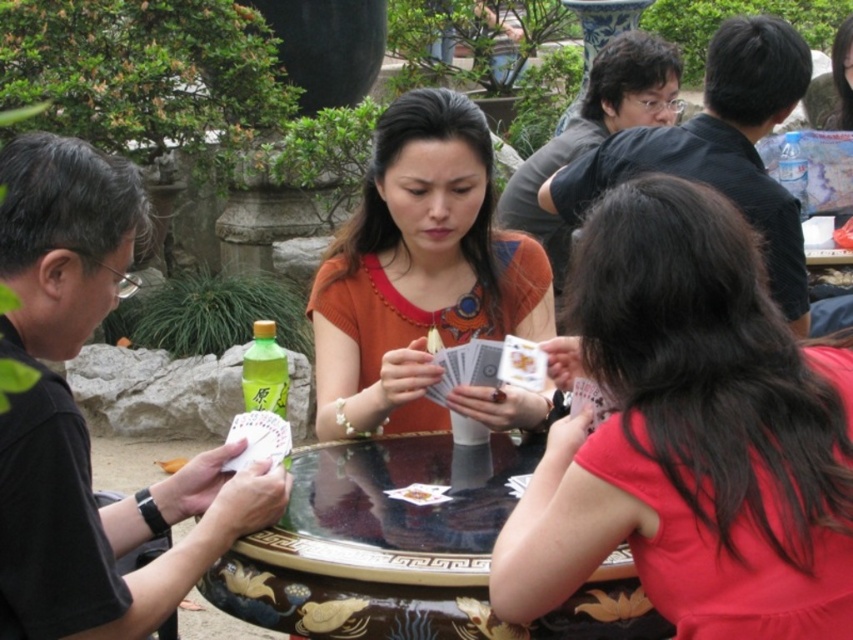
Question: Among these objects, which one is nearest to the camera?

Choices:
 (A) matte black shirt at upper right
 (B) black matte shirt at left

Answer: (B)

Question: Which point is closer to the camera taking this photo?

Choices:
 (A) (659, 90)
 (B) (851, 632)

Answer: (B)

Question: Does wooden polished table at center appear on the left side of matte black shirt at upper right?

Choices:
 (A) no
 (B) yes

Answer: (B)

Question: Is black matte shirt at left bigger than green matte bottle at center?

Choices:
 (A) no
 (B) yes

Answer: (B)

Question: Can you confirm if black matte shirt at left is positioned below green matte bottle at center?

Choices:
 (A) yes
 (B) no

Answer: (A)

Question: Among these points, which one is nearest to the camera?

Choices:
 (A) (773, 24)
 (B) (352, 234)
 (C) (503, 451)
 (D) (0, 458)

Answer: (D)